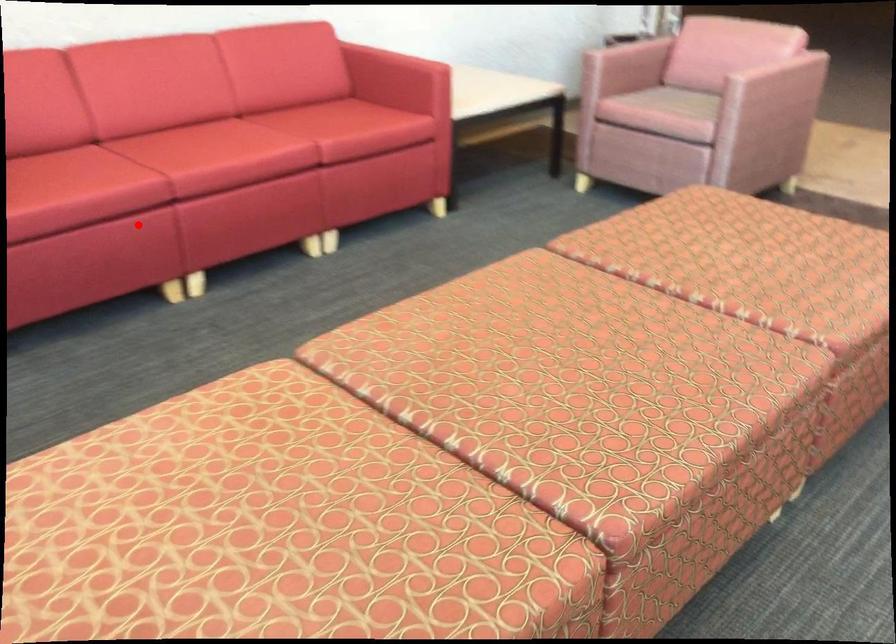
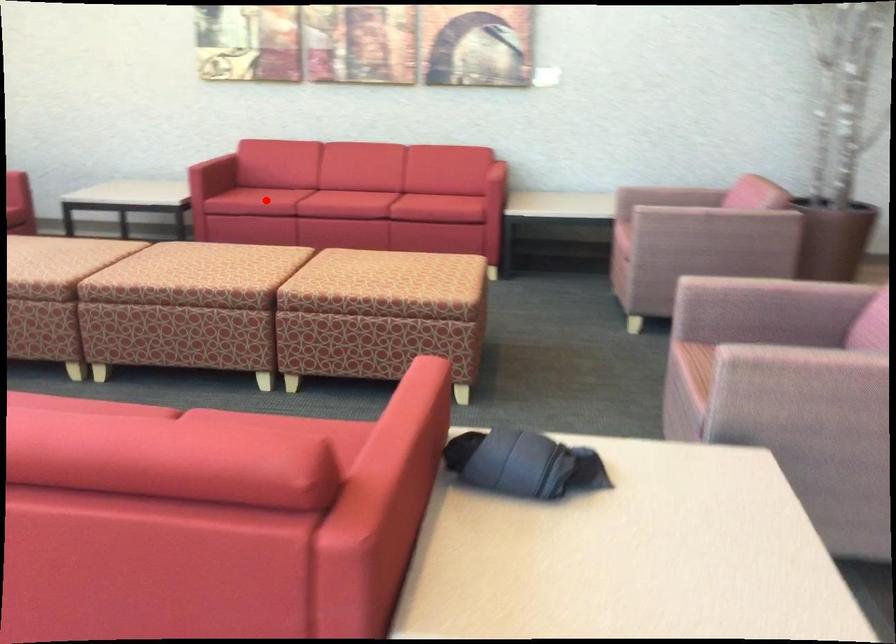
I am providing you with two images of the same scene from different viewpoints. A red point is marked on the first image and another point is marked on the second image. Do the highlighted points in image1 and image2 indicate the same real-world spot?

Yes